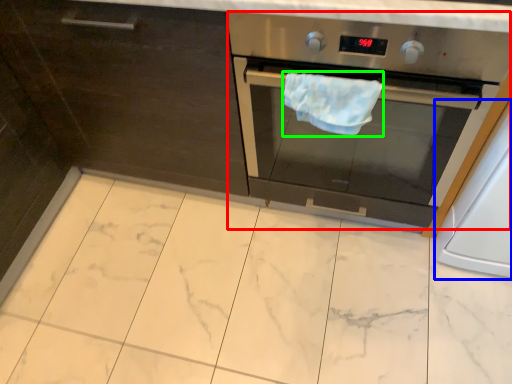
Question: Which object is the closest to the home appliance (highlighted by a red box)? Choose among these: appliance (highlighted by a blue box) or hand towel (highlighted by a green box).

Choices:
 (A) appliance
 (B) hand towel

Answer: (B)